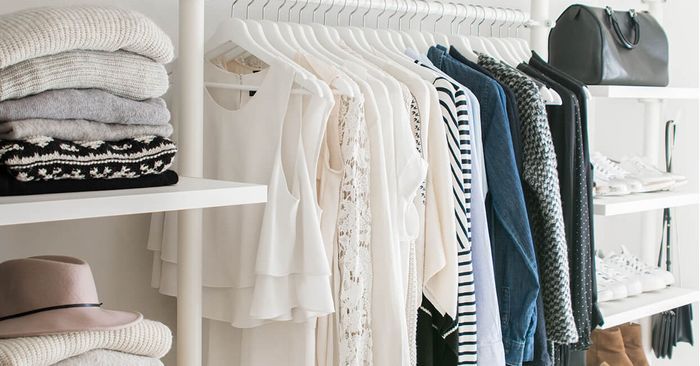
Locate an element on the screen. folded clothing is located at coordinates (131, 25), (111, 65), (102, 100), (82, 125), (78, 162), (116, 186), (148, 329), (113, 357).